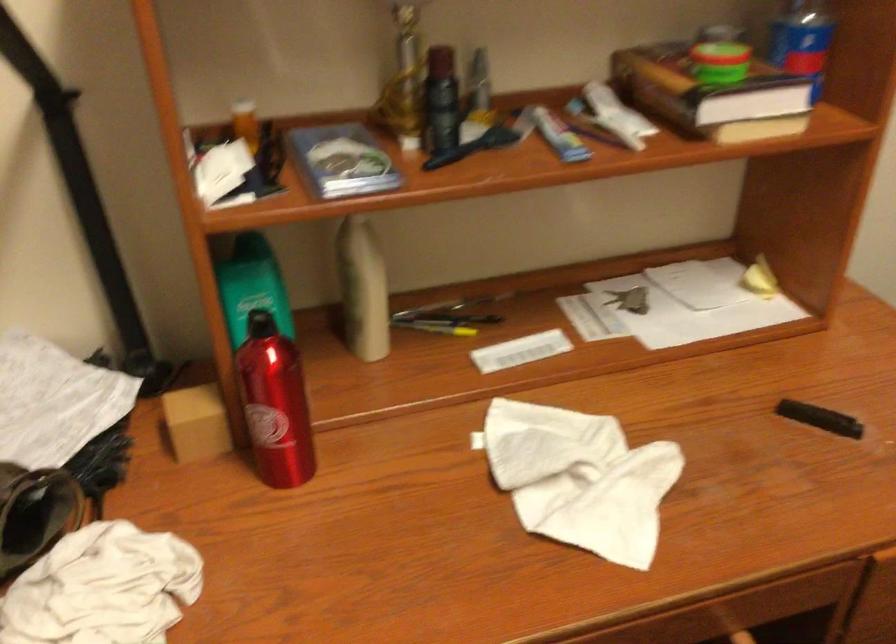
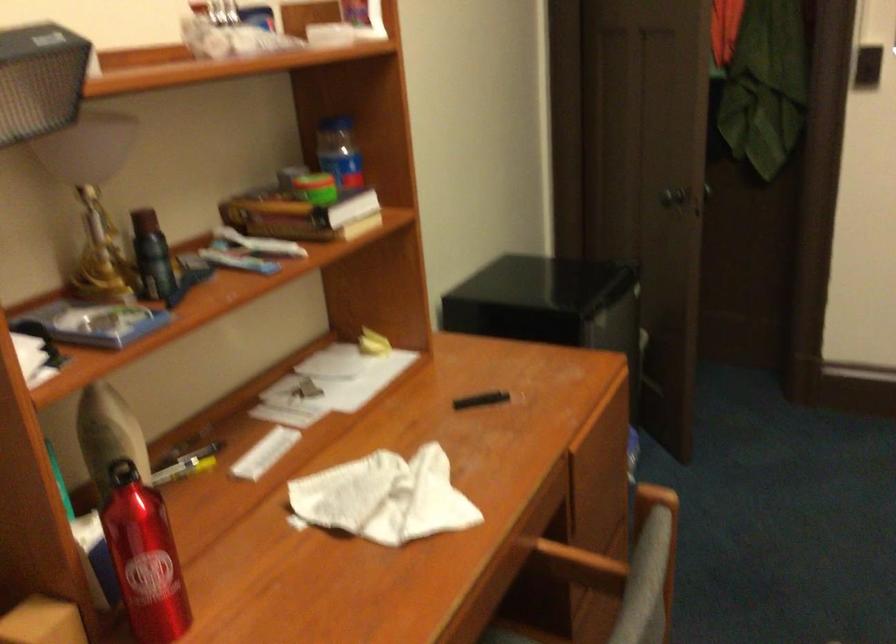
Question: The camera is either moving clockwise (left) or counter-clockwise (right) around the object. The first image is from the beginning of the video and the second image is from the end. Is the camera moving left or right when shooting the video?

Choices:
 (A) Left
 (B) Right

Answer: (A)